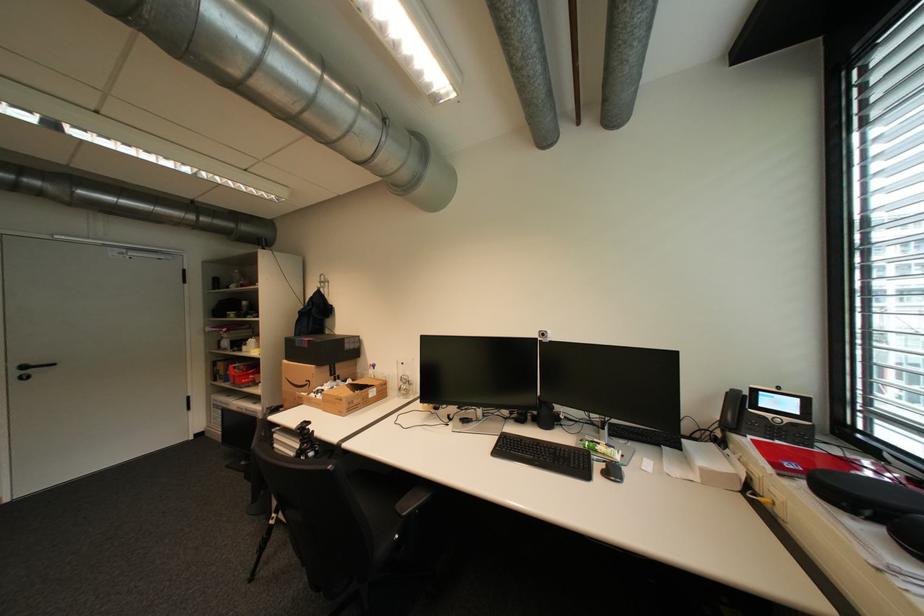
At what (x,y) coordinates should I click in order to perform the action: click on small webcam. Please return your answer as a coordinate pair (x, y). This screenshot has height=616, width=924. Looking at the image, I should click on (543, 334).